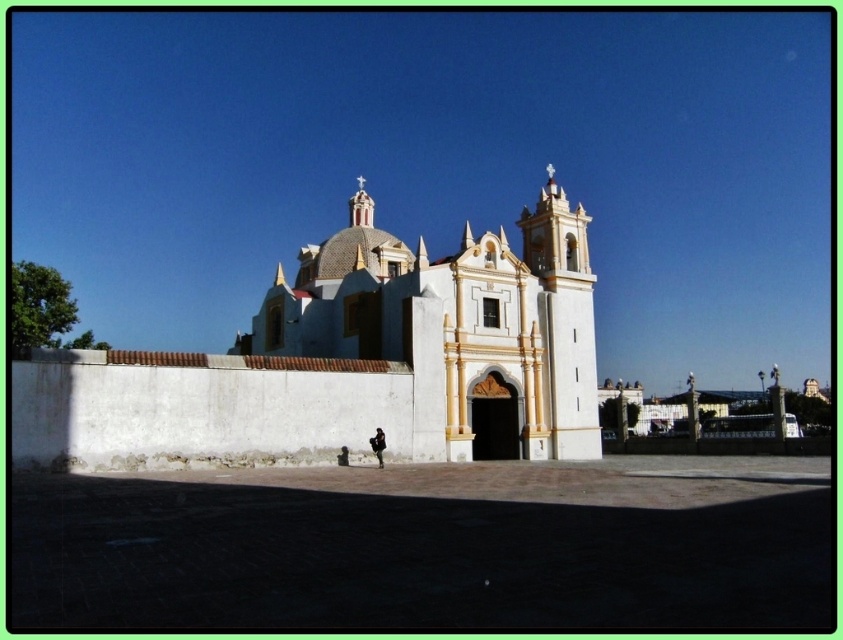
Question: Is white stucco church at center thinner than dark gray fabric jacket at lower center?

Choices:
 (A) yes
 (B) no

Answer: (B)

Question: Among these points, which one is nearest to the camera?

Choices:
 (A) (380, 460)
 (B) (501, 240)

Answer: (A)

Question: Can you confirm if white stucco church at center is wider than dark gray fabric jacket at lower center?

Choices:
 (A) yes
 (B) no

Answer: (A)

Question: Is white stucco church at center in front of dark gray fabric jacket at lower center?

Choices:
 (A) no
 (B) yes

Answer: (B)